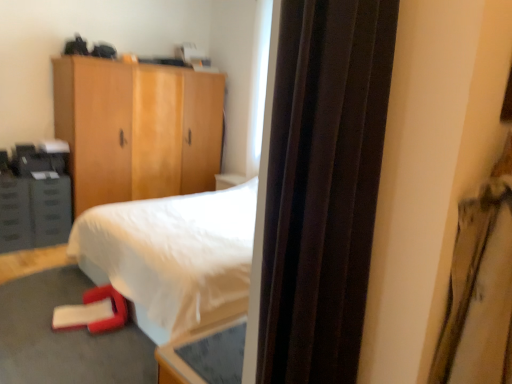
Question: Is wooden cabinet at upper left smaller than metallic gray drawer at left?

Choices:
 (A) yes
 (B) no

Answer: (B)

Question: Is wooden cabinet at upper left with metallic gray drawer at left?

Choices:
 (A) yes
 (B) no

Answer: (B)

Question: Considering the relative positions of wooden cabinet at upper left and metallic gray drawer at left in the image provided, is wooden cabinet at upper left to the right of metallic gray drawer at left from the viewer's perspective?

Choices:
 (A) no
 (B) yes

Answer: (B)

Question: Is wooden cabinet at upper left located outside metallic gray drawer at left?

Choices:
 (A) yes
 (B) no

Answer: (A)

Question: From a real-world perspective, is wooden cabinet at upper left located beneath metallic gray drawer at left?

Choices:
 (A) yes
 (B) no

Answer: (B)

Question: Considering the positions of point (24, 226) and point (202, 89), is point (24, 226) closer or farther from the camera than point (202, 89)?

Choices:
 (A) closer
 (B) farther

Answer: (A)

Question: Considering the positions of metallic gray drawer at left and wooden cabinet at upper left in the image, is metallic gray drawer at left bigger or smaller than wooden cabinet at upper left?

Choices:
 (A) big
 (B) small

Answer: (B)

Question: Is metallic gray drawer at left inside the boundaries of wooden cabinet at upper left, or outside?

Choices:
 (A) inside
 (B) outside

Answer: (B)

Question: Is metallic gray drawer at left wider or thinner than wooden cabinet at upper left?

Choices:
 (A) thin
 (B) wide

Answer: (A)

Question: From a real-world perspective, is metallic gray drawer at left physically located above or below satin brown curtain at right?

Choices:
 (A) below
 (B) above

Answer: (A)

Question: Is metallic gray drawer at left inside or outside of satin brown curtain at right?

Choices:
 (A) inside
 (B) outside

Answer: (B)

Question: Is point (1, 221) closer or farther from the camera than point (369, 114)?

Choices:
 (A) closer
 (B) farther

Answer: (B)

Question: Visually, is metallic gray drawer at left positioned to the left or to the right of satin brown curtain at right?

Choices:
 (A) left
 (B) right

Answer: (A)

Question: From the image's perspective, relative to wooden cabinet at upper left, is matte gray cabinet at left above or below?

Choices:
 (A) above
 (B) below

Answer: (B)

Question: Is point (40, 185) closer or farther from the camera than point (89, 135)?

Choices:
 (A) farther
 (B) closer

Answer: (B)